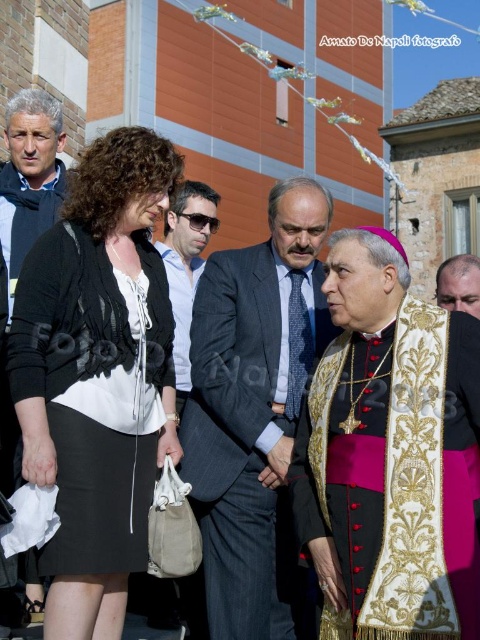
Consider the image. Is matte black sweater at left closer to the viewer compared to gold embroidered stole at right?

Yes, matte black sweater at left is in front of gold embroidered stole at right.

Which is behind, point (52, 182) or point (452, 282)?

The point (452, 282) is more distant.

The height and width of the screenshot is (640, 480). I want to click on matte black sweater at left, so click(x=29, y=177).

Can you confirm if dark gray suit at center is positioned below matte black sweater at left?

Correct, dark gray suit at center is located below matte black sweater at left.

Between point (252, 484) and point (56, 129), which one is positioned behind?

The point (56, 129) is more distant.

Who is more distant from viewer, (x=252, y=362) or (x=25, y=602)?

Positioned behind is point (x=252, y=362).

Image resolution: width=480 pixels, height=640 pixels. Identify the location of dark gray suit at center. (253, 408).

Between point (441, 600) and point (38, 227), which one is positioned in front?

Point (441, 600) is in front.

Between gold embroidered vestment at right and matte black sweater at left, which one appears on the left side from the viewer's perspective?

matte black sweater at left

Is point (380, 417) positioned behind point (27, 244)?

No, it is in front of (27, 244).

This screenshot has height=640, width=480. What are the coordinates of `gold embroidered vestment at right` in the screenshot? It's located at (396, 476).